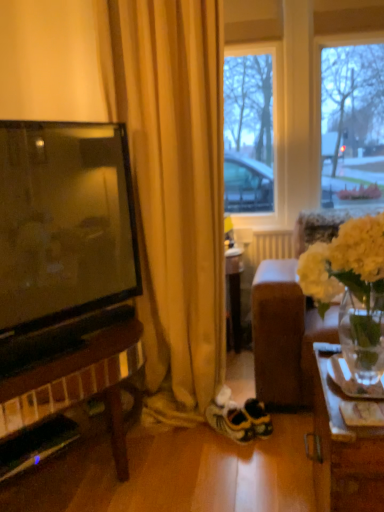
Question: From the image's perspective, is white matte vase at right on top of white suede sneakers at center?

Choices:
 (A) no
 (B) yes

Answer: (B)

Question: Is white matte vase at right far away from white suede sneakers at center?

Choices:
 (A) no
 (B) yes

Answer: (A)

Question: Is white suede sneakers at center completely or partially inside white matte vase at right?

Choices:
 (A) yes
 (B) no

Answer: (B)

Question: Can you confirm if white matte vase at right is bigger than white suede sneakers at center?

Choices:
 (A) no
 (B) yes

Answer: (B)

Question: Is white matte vase at right shorter than white suede sneakers at center?

Choices:
 (A) no
 (B) yes

Answer: (A)

Question: Is white matte vase at right positioned beyond the bounds of white suede sneakers at center?

Choices:
 (A) no
 (B) yes

Answer: (B)

Question: Is yellow fabric curtain at left closer to camera compared to white suede sneakers at center?

Choices:
 (A) no
 (B) yes

Answer: (B)

Question: Would you consider yellow fabric curtain at left to be distant from white suede sneakers at center?

Choices:
 (A) yes
 (B) no

Answer: (B)

Question: Is yellow fabric curtain at left to the right of white suede sneakers at center from the viewer's perspective?

Choices:
 (A) yes
 (B) no

Answer: (B)

Question: Is yellow fabric curtain at left not inside white suede sneakers at center?

Choices:
 (A) yes
 (B) no

Answer: (A)

Question: Can you confirm if yellow fabric curtain at left is smaller than white suede sneakers at center?

Choices:
 (A) yes
 (B) no

Answer: (B)

Question: Is yellow fabric curtain at left to the left of white suede sneakers at center from the viewer's perspective?

Choices:
 (A) yes
 (B) no

Answer: (A)

Question: From a real-world perspective, is white suede sneakers at center located beneath white fabric couch at right?

Choices:
 (A) yes
 (B) no

Answer: (A)